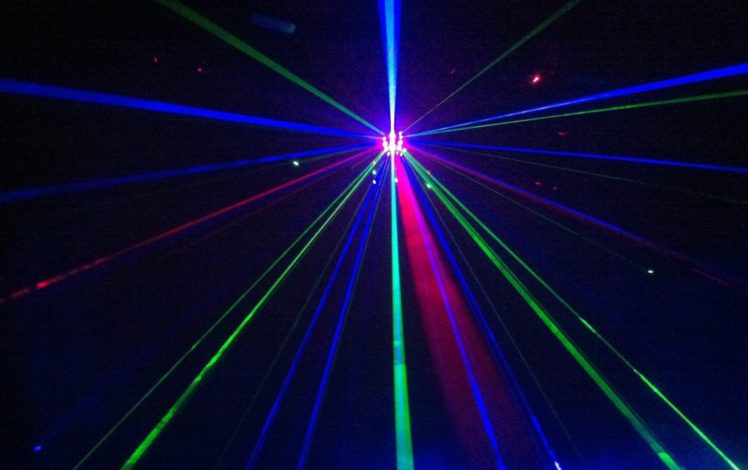
What are the coordinates of `ceiling` in the screenshot? It's located at (493, 84), (242, 321).